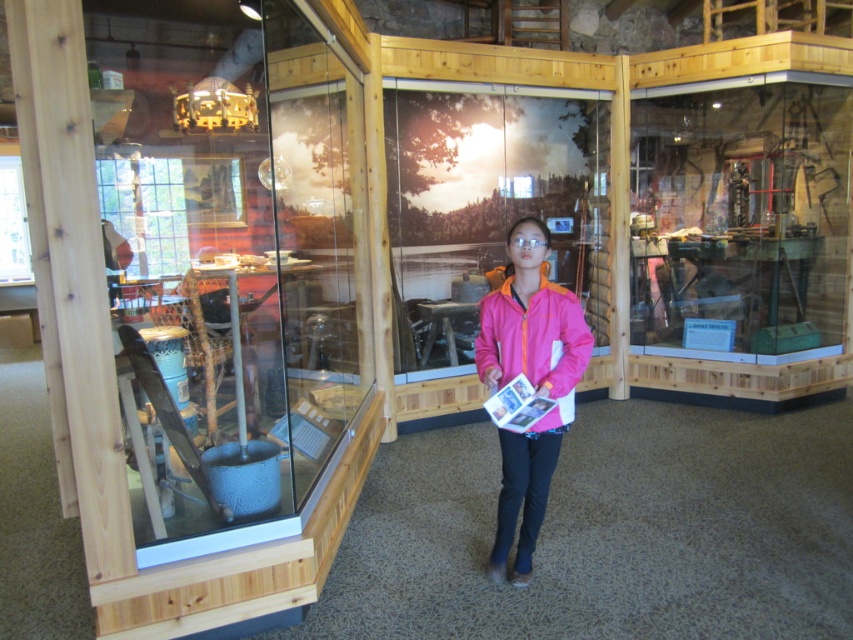
You are an assistant at the museum and need to determine which jacket is taller between the pink matte jacket at center and the pink fleece jacket at center. Which one is taller?

The pink matte jacket at center is taller than the pink fleece jacket at center according to the description provided.

You are a fashion designer observing two jackets in the museum exhibit. The pink matte jacket at center and the pink fleece jacket at center are both displayed. Which jacket is bigger in size?

The pink matte jacket at center is larger in size compared to the pink fleece jacket at center.